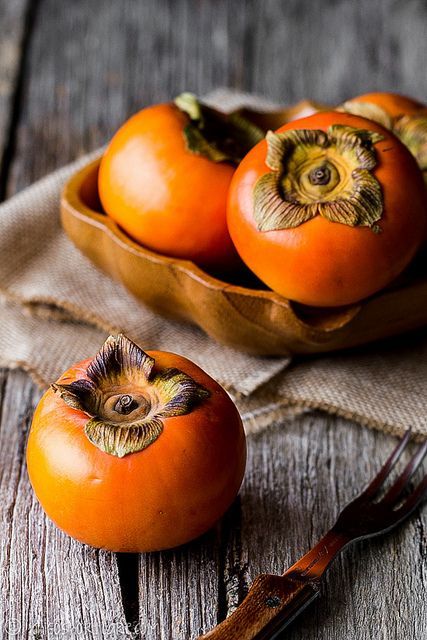
This screenshot has width=427, height=640. Find the location of `metal of fork inside wooden handle`. metal of fork inside wooden handle is located at coordinates (312, 598), (295, 614).